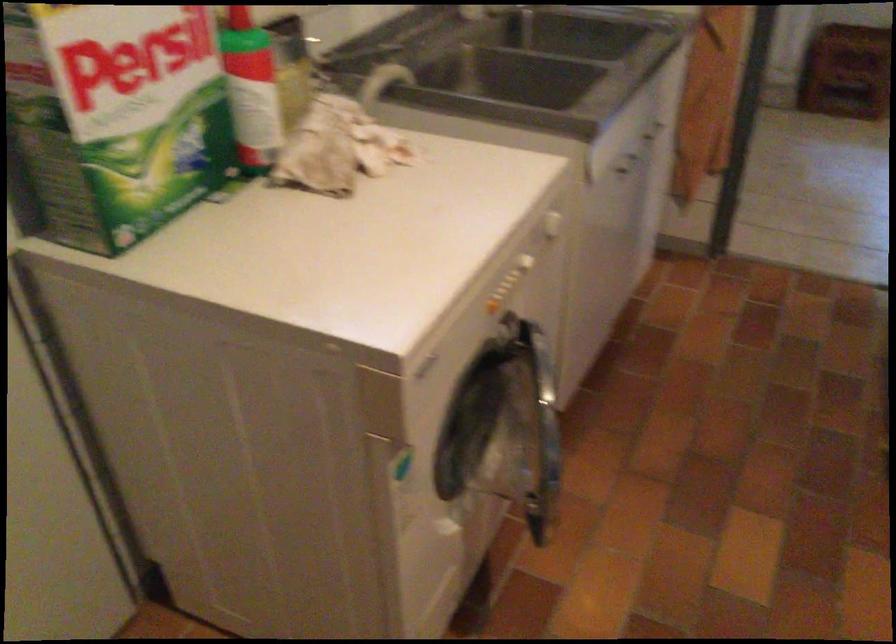
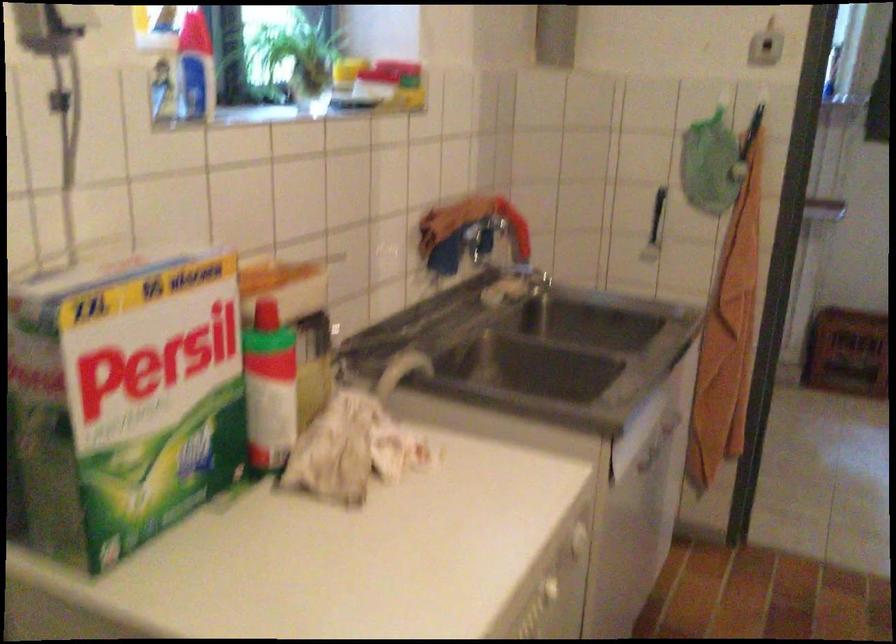
Question: Based on the continuous images, in which direction is the camera rotating? Reply with the corresponding letter.

Choices:
 (A) Left
 (B) Right
 (C) Up
 (D) Down

Answer: (C)